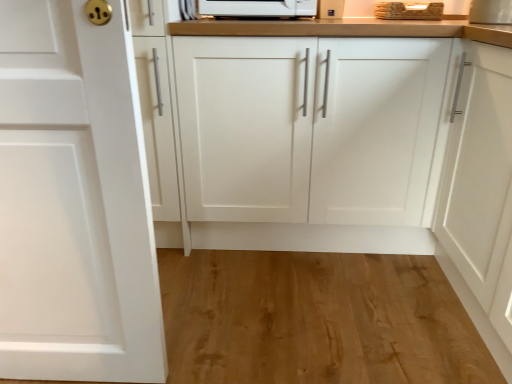
Question: Considering the positions of point pyautogui.click(x=94, y=44) and point pyautogui.click(x=394, y=304), is point pyautogui.click(x=94, y=44) closer or farther from the camera than point pyautogui.click(x=394, y=304)?

Choices:
 (A) farther
 (B) closer

Answer: (B)

Question: Would you say white matte cabinet door at left, which is the 1th cabinetry from front to back, is to the left or to the right of natural wood flooring at lower center in the picture?

Choices:
 (A) left
 (B) right

Answer: (A)

Question: Estimate the real-world distances between objects in this image. Which object is closer to the natural wood flooring at lower center?

Choices:
 (A) metallic silver toaster at upper center
 (B) white matte cabinet at center, which is the 1th cabinetry in back-to-front order
 (C) white matte cabinet door at left, acting as the 2th cabinetry starting from the back
 (D) wooden at upper right

Answer: (B)

Question: Considering the real-world distances, which object is closest to the metallic silver toaster at upper center?

Choices:
 (A) white matte cabinet at center, which appears as the second cabinetry when viewed from the left
 (B) natural wood flooring at lower center
 (C) white matte cabinet door at left, placed as the second cabinetry when sorted from right to left
 (D) wooden at upper right

Answer: (D)